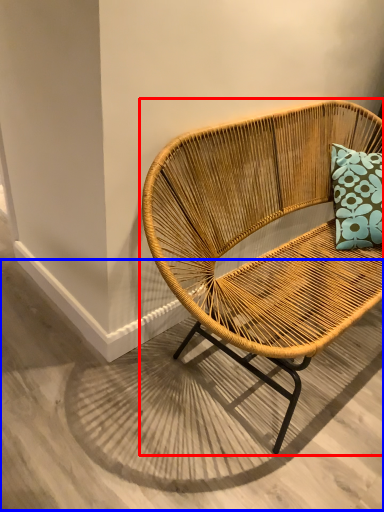
Question: Among these objects, which one is farthest to the camera, chair (highlighted by a red box) or concrete (highlighted by a blue box)?

Choices:
 (A) chair
 (B) concrete

Answer: (B)